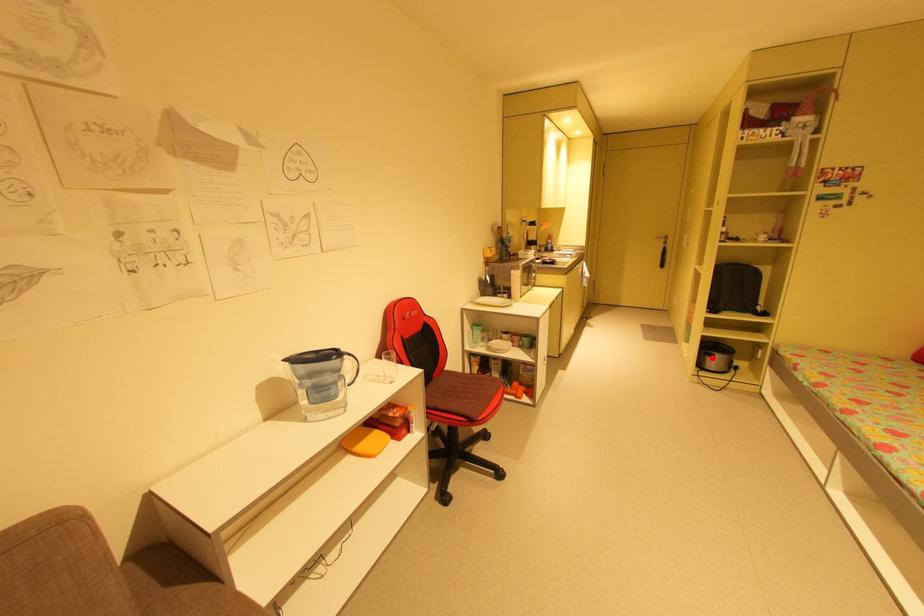
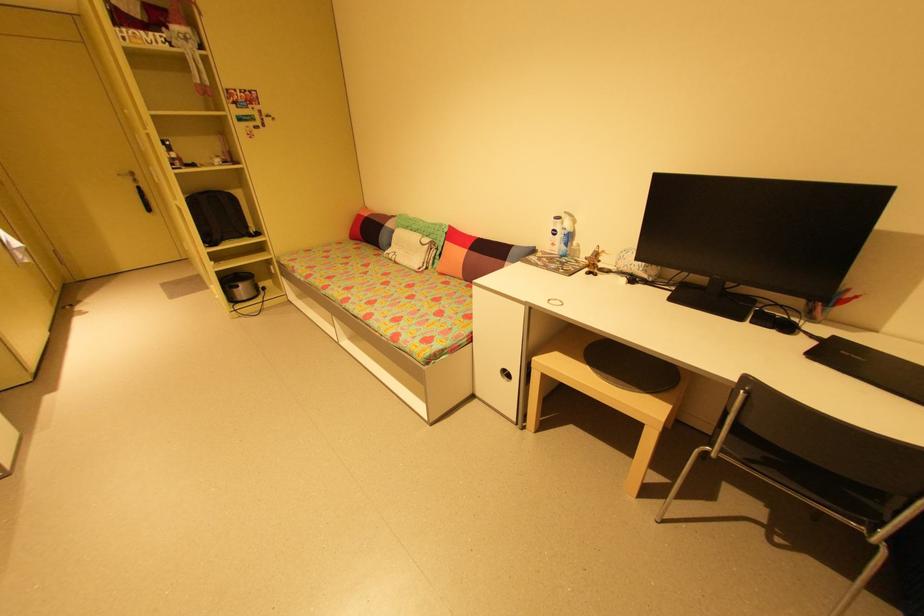
Question: I am providing you with two images of the same scene from different viewpoints. A red point is shown in image1. For the corresponding object point in image2, is it positioned nearer or farther from the camera?

Choices:
 (A) Nearer
 (B) Farther

Answer: (A)